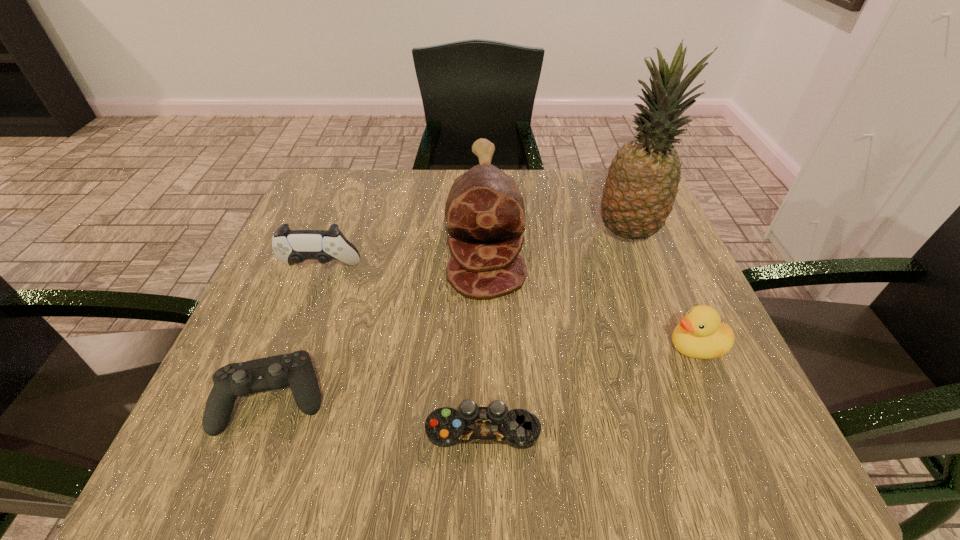
This screenshot has width=960, height=540. Find the location of `object present at the far right corner`. object present at the far right corner is located at coordinates (642, 184).

Where is `vacant space at the far edge`? The image size is (960, 540). vacant space at the far edge is located at coordinates (567, 183).

Where is `vacant space at the near edge of the desktop`? The image size is (960, 540). vacant space at the near edge of the desktop is located at coordinates (500, 447).

Where is `vacant region at the left edge of the desktop`? vacant region at the left edge of the desktop is located at coordinates (319, 345).

Find the location of `vacant area at the right edge`. vacant area at the right edge is located at coordinates (625, 335).

In the image, there is a desktop. Where is `free region at the far left corner`? free region at the far left corner is located at coordinates (368, 201).

You are a GUI agent. You are given a task and a screenshot of the screen. Output one action in this format:
    pyautogui.click(x=<x>, y=<y>)
    Task: Click on the vacant point located between the shortest control and the second tallest object
    Image resolution: width=960 pixels, height=540 pixels.
    Given the screenshot: What is the action you would take?
    pyautogui.click(x=484, y=328)

This screenshot has width=960, height=540. I want to click on unoccupied area between the duckling and the farthest control, so click(x=508, y=308).

Image resolution: width=960 pixels, height=540 pixels. I want to click on free spot between the rightmost control and the second shortest control, so click(378, 414).

This screenshot has height=540, width=960. Find the location of `vacant space in between the pineapple and the ham`. vacant space in between the pineapple and the ham is located at coordinates (556, 230).